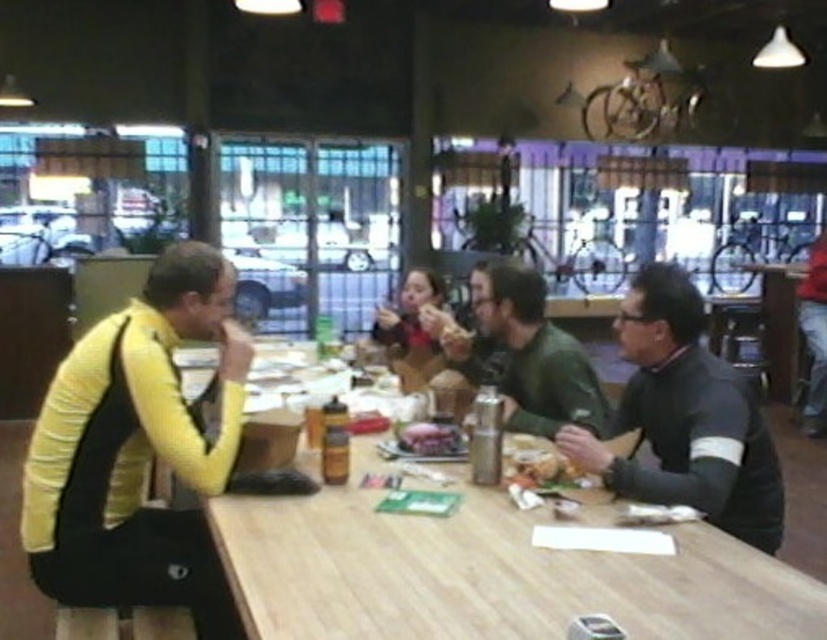
This screenshot has width=827, height=640. I want to click on dark gray sweater at right, so click(686, 417).

Is dark gray sweater at right closer to camera compared to green matte jacket at center?

Yes, it is in front of green matte jacket at center.

Identify the location of dark gray sweater at right. (686, 417).

Is yellow sweater at left smaller than matte black jacket at center?

Incorrect, yellow sweater at left is not smaller in size than matte black jacket at center.

Is yellow sweater at left further to camera compared to matte black jacket at center?

That is False.

Between point (194, 568) and point (414, 320), which one is positioned behind?

The point (414, 320) is behind.

The image size is (827, 640). In order to click on yellow sweater at left in this screenshot , I will do `click(137, 451)`.

Does point (110, 570) lie in front of point (484, 266)?

Yes, it is in front of point (484, 266).

Image resolution: width=827 pixels, height=640 pixels. Describe the element at coordinates (137, 451) in the screenshot. I see `yellow sweater at left` at that location.

Identify the location of yellow sweater at left. (137, 451).